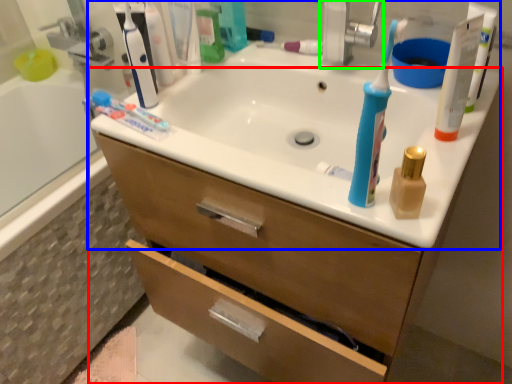
Question: Which object is the closest to the bathroom cabinet (highlighted by a red box)? Choose among these: sink (highlighted by a blue box) or faucet (highlighted by a green box).

Choices:
 (A) sink
 (B) faucet

Answer: (A)